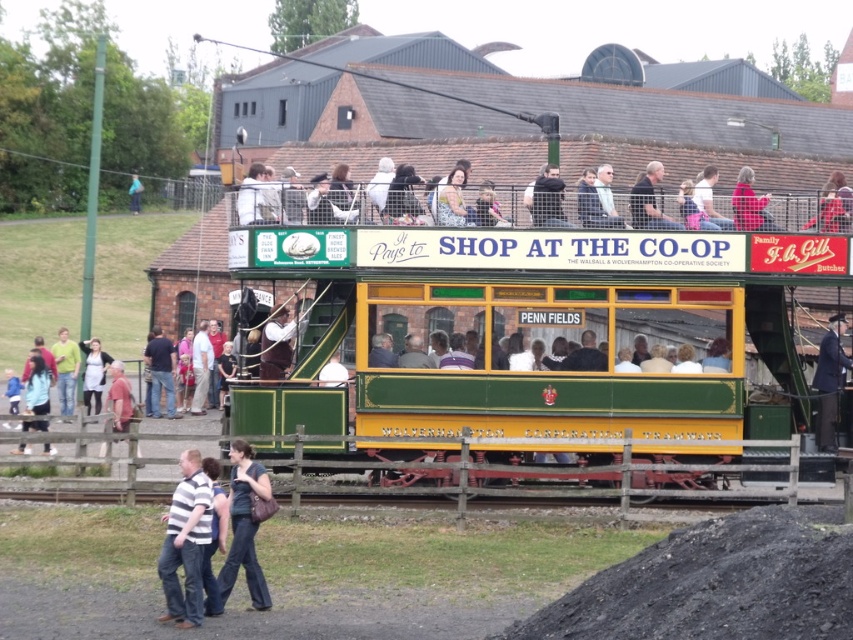
Question: Can you confirm if green wooden train at center is positioned to the left of dark blue fabric purse at lower center?

Choices:
 (A) no
 (B) yes

Answer: (A)

Question: Where is green wooden train at center located in relation to dark blue fabric purse at lower center in the image?

Choices:
 (A) left
 (B) right

Answer: (B)

Question: Which point is closer to the camera taking this photo?

Choices:
 (A) (744, 317)
 (B) (265, 595)

Answer: (B)

Question: Among these objects, which one is farthest from the camera?

Choices:
 (A) green wooden train at center
 (B) dark blue fabric purse at lower center

Answer: (A)

Question: Does green wooden train at center appear over dark blue fabric purse at lower center?

Choices:
 (A) yes
 (B) no

Answer: (A)

Question: Which object appears closest to the camera in this image?

Choices:
 (A) green wooden train at center
 (B) dark blue fabric purse at lower center

Answer: (B)